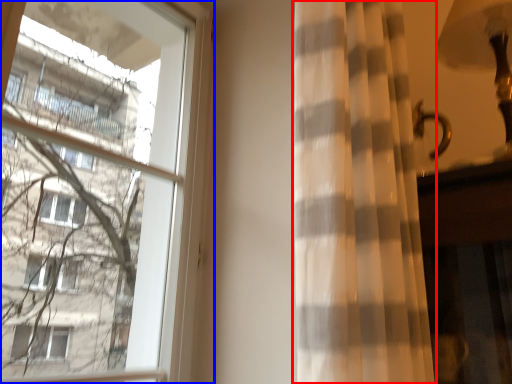
Question: Among these objects, which one is nearest to the camera, curtain (highlighted by a red box) or window (highlighted by a blue box)?

Choices:
 (A) curtain
 (B) window

Answer: (A)